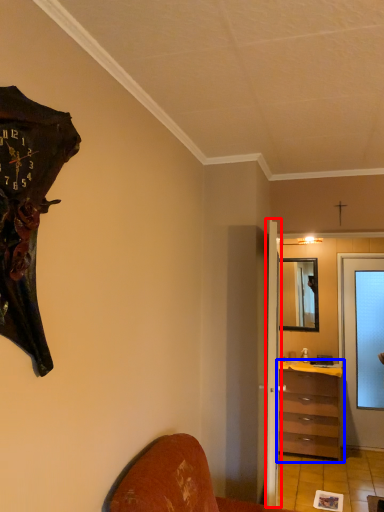
Question: Which point is further to the camera, door (highlighted by a red box) or chest of drawers (highlighted by a blue box)?

Choices:
 (A) door
 (B) chest of drawers

Answer: (B)